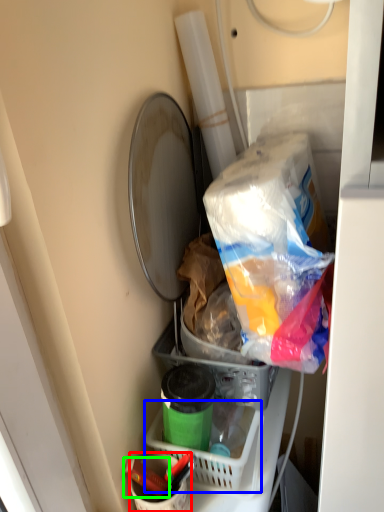
Question: Based on their relative distances, which object is nearer to bucket (highlighted by a red box)? Choose from basket (highlighted by a blue box) and crayon (highlighted by a green box).

Choices:
 (A) basket
 (B) crayon

Answer: (B)